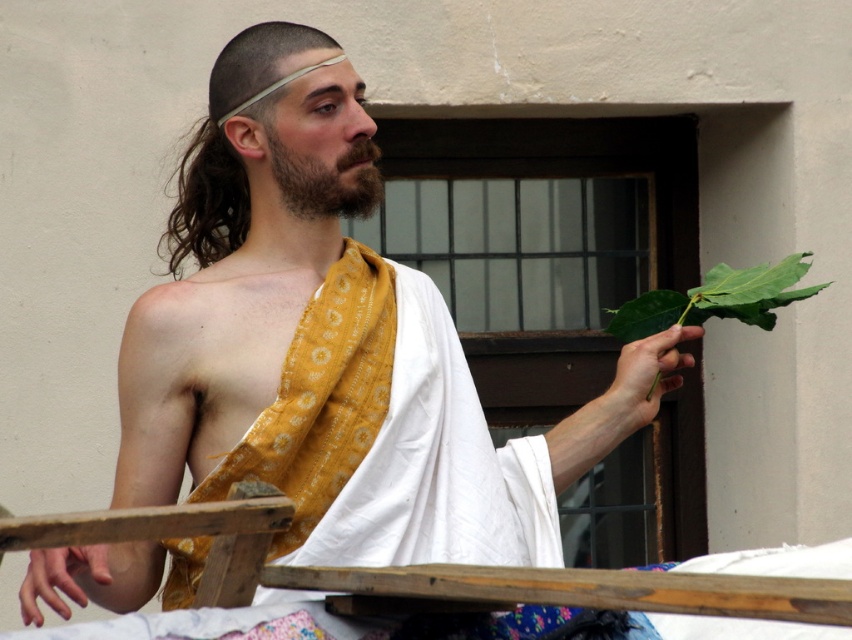
Looking at this image, is dark brown thick beard at center shorter than green leafy stem at right?

Indeed, dark brown thick beard at center has a lesser height compared to green leafy stem at right.

The height and width of the screenshot is (640, 852). I want to click on dark brown thick beard at center, so 326,177.

Does green leafy stem at right appear on the left side of smooth skin hand at lower left?

Incorrect, green leafy stem at right is not on the left side of smooth skin hand at lower left.

Between green leafy stem at right and smooth skin hand at lower left, which one appears on the left side from the viewer's perspective?

smooth skin hand at lower left

Find the location of `green leafy stem at right`. green leafy stem at right is located at coordinates (643, 378).

Which is above, wooden at lower center or green leafy stem at right?

green leafy stem at right

Does wooden at lower center appear over green leafy stem at right?

No.

Is point (252, 616) less distant than point (614, 392)?

Yes, point (252, 616) is closer to viewer.

Find the location of `wooden at lower center`. wooden at lower center is located at coordinates (689, 566).